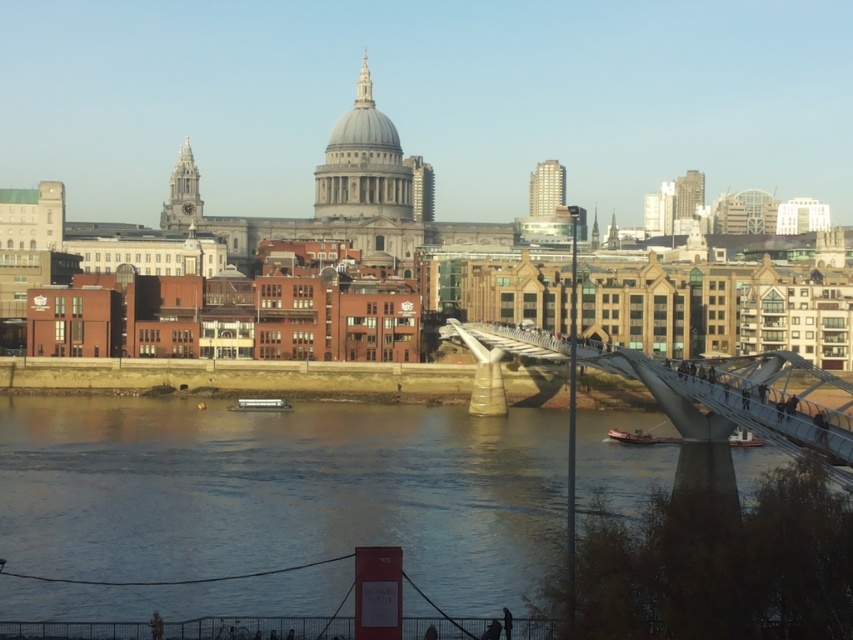
You are a tourist standing on the Millennium Bridge and want to take a photo of St. Paul Cathedral with the clear water at lower center in the foreground. Can you do that while standing on the metallic gray bridge at center?

The metallic gray bridge at center is behind the clear water at lower center, so you can take a photo of St. Paul Cathedral with the clear water at lower center in the foreground while standing on the metallic gray bridge at center.

Based on the photo, you are standing at the Millennium Bridge and want to take a photo of the clear water at lower center. Where should you look to capture it in your camera?

You should look towards the point at coordinates (282, 492) to capture the clear water at lower center in your camera.

You are a tourist standing on the Millennium Bridge and want to take a photo of the St. Paul Cathedral. To avoid the bridge from blocking the view, where should you position yourself relative to the metallic gray bridge at center and the clear water at lower center?

You should position yourself behind the metallic gray bridge at center so that the clear water at lower center is between you and the cathedral, as the clear water at lower center is located below the bridge. This way, the bridge won